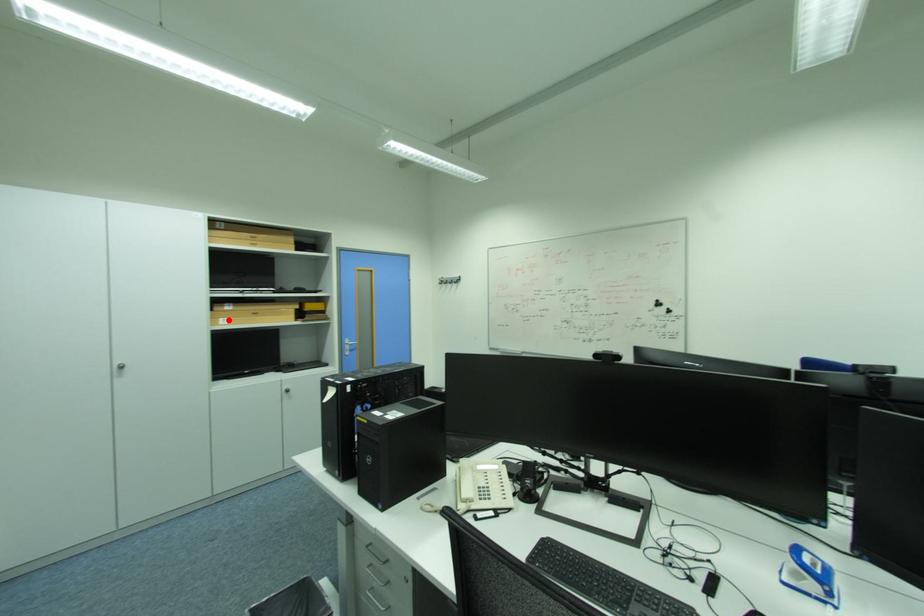
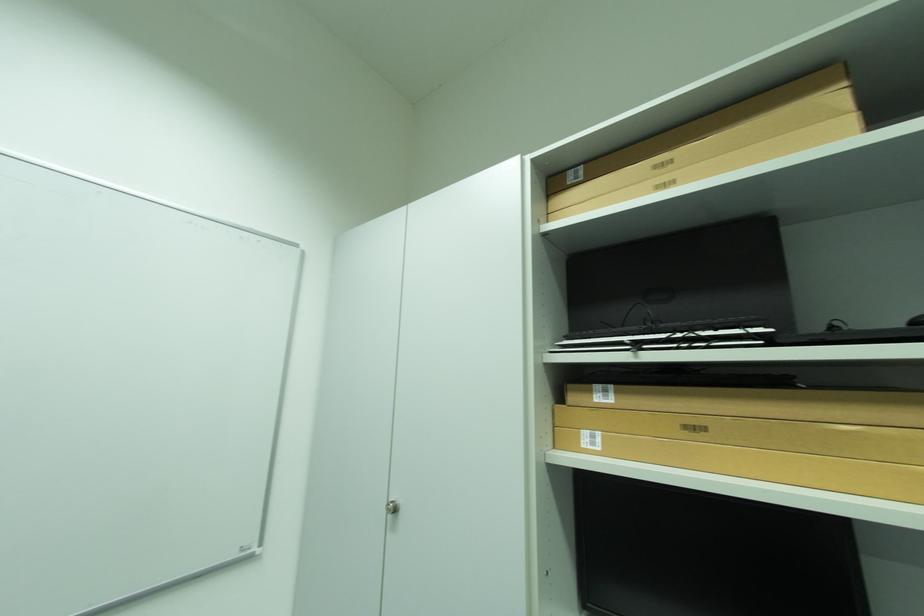
The point at the highlighted location is marked in the first image. Where is the corresponding point in the second image?

(593, 434)